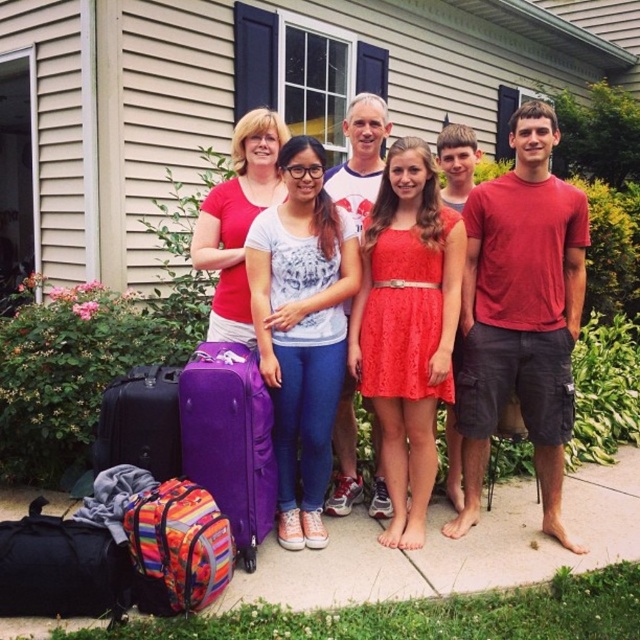
Question: Does red cotton t-shirt at center appear over lace dress at center?

Choices:
 (A) yes
 (B) no

Answer: (A)

Question: Where is lace dress at center located in relation to black fabric duffel bag at lower left in the image?

Choices:
 (A) below
 (B) above

Answer: (B)

Question: Which object is the farthest from the matte white t-shirt at center?

Choices:
 (A) purple fabric suitcase at lower left
 (B) matte purple suitcase at left
 (C) white cotton t-shirt at center

Answer: (B)

Question: Estimate the real-world distances between objects in this image. Which object is farther from the matte white t-shirt at center?

Choices:
 (A) white cotton t-shirt at center
 (B) lace dress at center
 (C) matte purple suitcase at lower left

Answer: (B)

Question: Does matte purple suitcase at left appear over red cotton t-shirt at center?

Choices:
 (A) no
 (B) yes

Answer: (B)

Question: Based on their relative distances, which object is nearer to the purple fabric suitcase at lower left?

Choices:
 (A) matte purple suitcase at left
 (B) multicolored fabric backpack at lower left

Answer: (B)